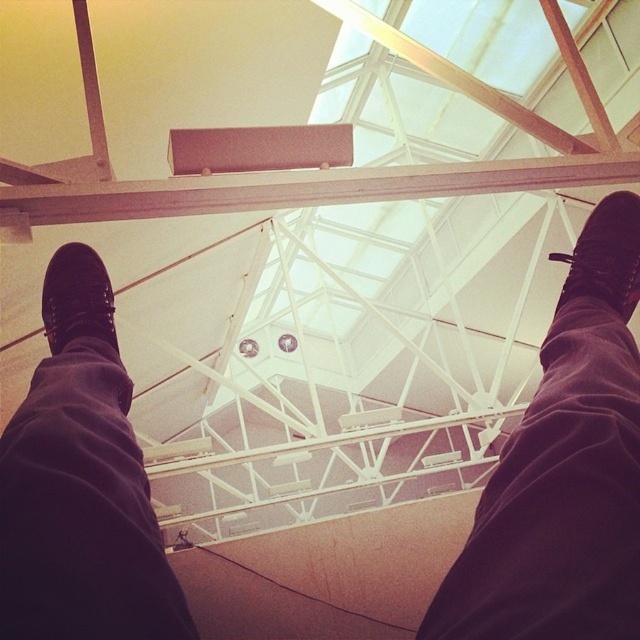
You are a photographer setting up a shoot in this location. You need to place a small tripod between the black suede shoes at upper center and the black leather shoe at left. Given that the tripod requires a minimum space of 15 cm between the two objects, can you determine if there is enough space based on their widths?

The black suede shoes at upper center are wider than the black leather shoe at left. However, the exact distance between them isn not specified in the provided information. Therefore, it is impossible to determine if there is enough space for the tripod without additional measurements.

You are trying to determine the position of your shoes relative to each other. Which shoe is closer to you, the observer, between the black suede shoes at upper center and the black leather shoe at right?

The black suede shoes at upper center is closer to you because it is positioned in front of the black leather shoe at right.